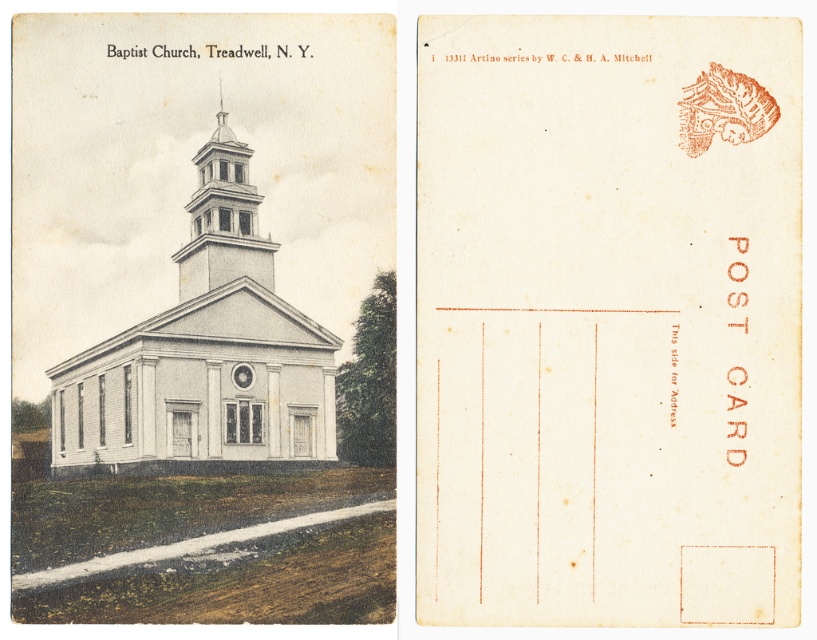
Question: Estimate the real-world distances between objects in this image. Which object is closer to the white wood church at center?

Choices:
 (A) white wood tower at center
 (B) white paper at center

Answer: (A)

Question: Among these objects, which one is farthest from the camera?

Choices:
 (A) white paper at center
 (B) white wood tower at center
 (C) white wood church at center

Answer: (B)

Question: Which point appears farthest from the camera in this image?

Choices:
 (A) pos(213,246)
 (B) pos(567,170)
 (C) pos(179,292)

Answer: (C)

Question: Is white wood church at center to the right of white wood tower at center from the viewer's perspective?

Choices:
 (A) yes
 (B) no

Answer: (B)

Question: Can you confirm if white paper at center is bigger than white wood church at center?

Choices:
 (A) yes
 (B) no

Answer: (B)

Question: Is white paper at center to the right of white wood tower at center from the viewer's perspective?

Choices:
 (A) yes
 (B) no

Answer: (A)